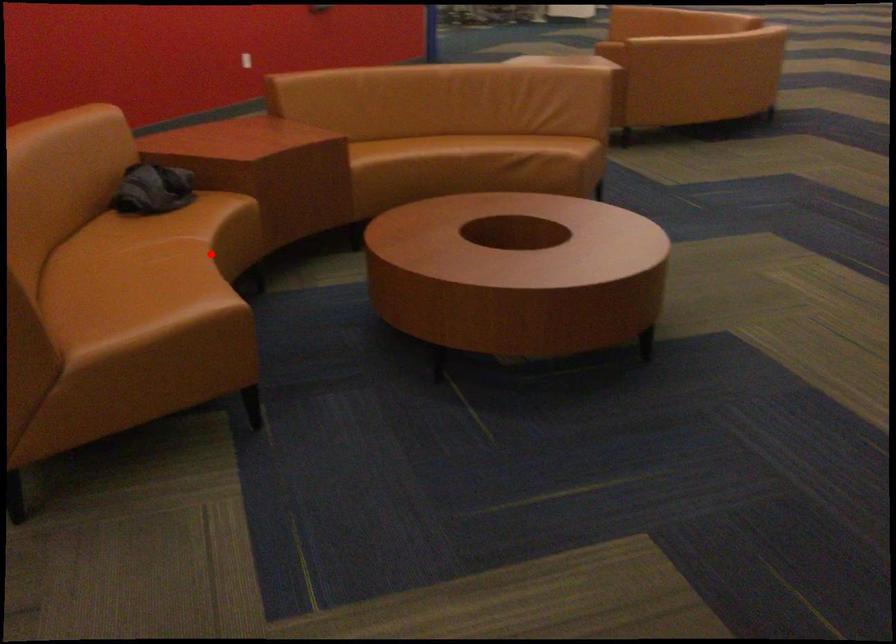
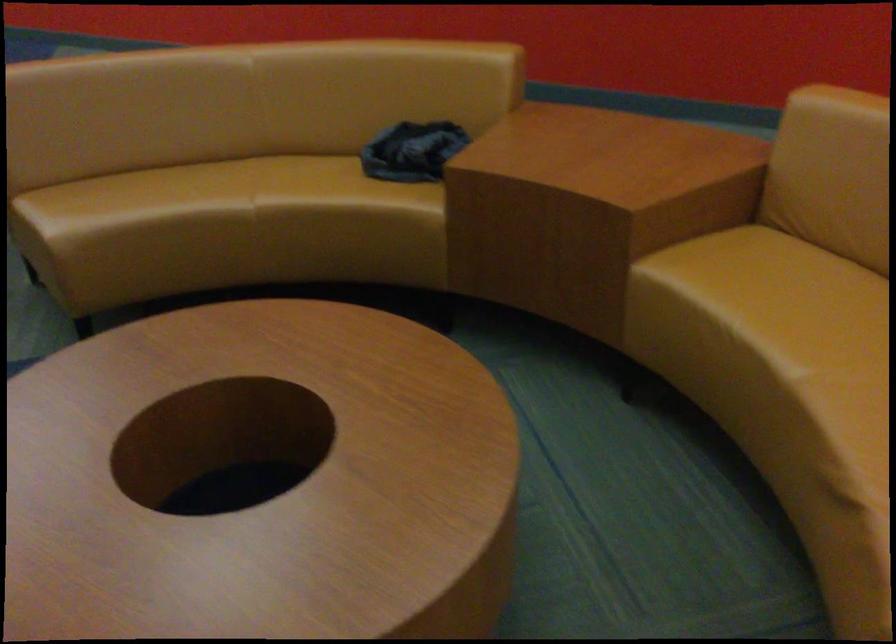
Question: I am providing you with two images of the same scene from different viewpoints. A red point is shown in image1. For the corresponding object point in image2, is it positioned nearer or farther from the camera?

Choices:
 (A) Nearer
 (B) Farther

Answer: (A)